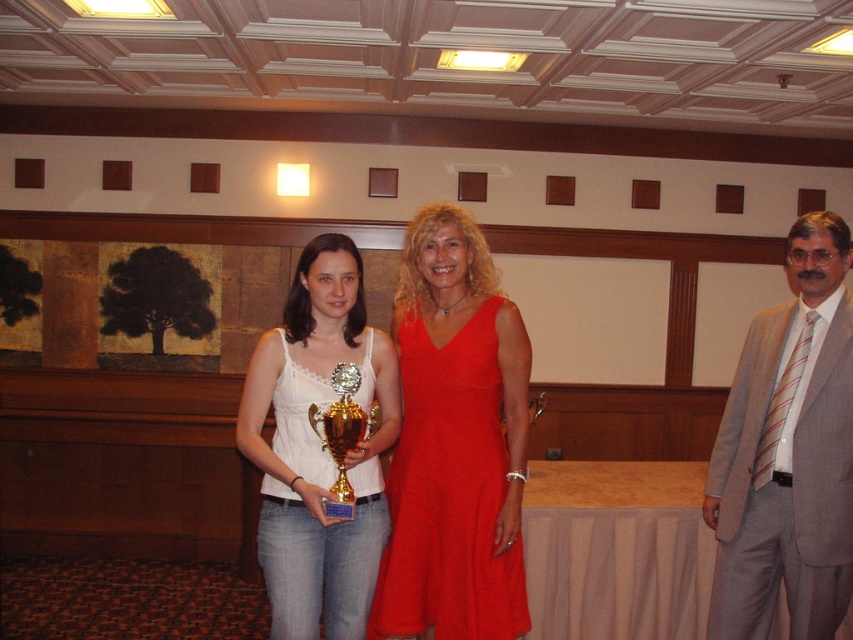
Consider the image. Does red satin dress at center appear under gold shiny trophy at center?

Yes, red satin dress at center is below gold shiny trophy at center.

Who is lower down, red satin dress at center or gold shiny trophy at center?

red satin dress at center is below.

Does point (477, 352) lie behind point (332, 451)?

That is True.

Identify the location of red satin dress at center. This screenshot has width=853, height=640. (450, 493).

Is white fabric tank top at center to the right of gold shiny trophy at center from the viewer's perspective?

Incorrect, white fabric tank top at center is not on the right side of gold shiny trophy at center.

Does white fabric tank top at center have a lesser height compared to gold shiny trophy at center?

No, white fabric tank top at center is not shorter than gold shiny trophy at center.

The height and width of the screenshot is (640, 853). In order to click on white fabric tank top at center in this screenshot , I will do `click(318, 448)`.

Find the location of a particular element. The image size is (853, 640). white fabric tank top at center is located at coordinates (318, 448).

Between point (288, 404) and point (343, 490), which one is positioned in front?

Point (343, 490)

At what (x,y) coordinates should I click in order to perform the action: click on white fabric dress at center. Please return your answer as a coordinate pair (x, y). This screenshot has height=640, width=853. Looking at the image, I should click on (300, 420).